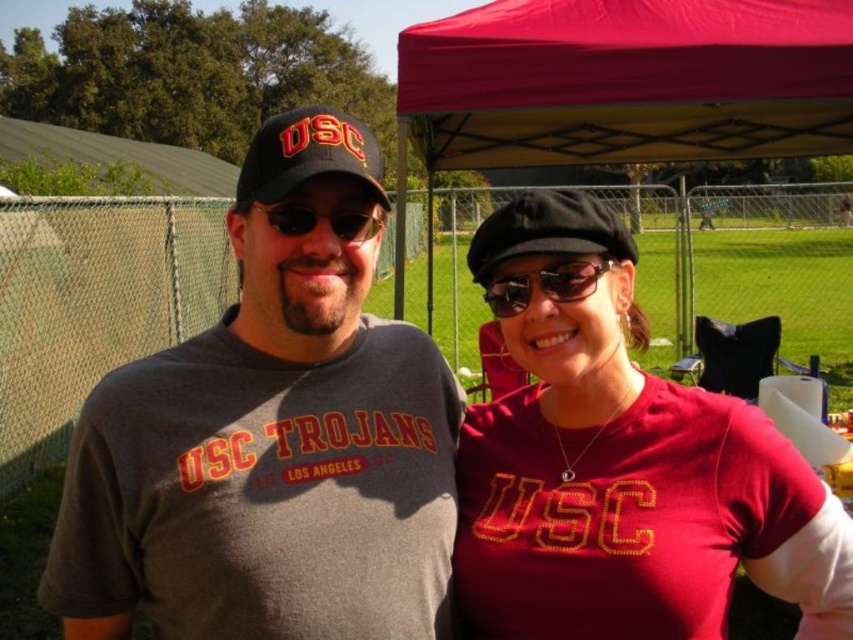
Question: Does gray matte t-shirt at center have a lesser width compared to black matte baseball cap at upper left?

Choices:
 (A) yes
 (B) no

Answer: (A)

Question: Can you confirm if black matte baseball cap at upper left is thinner than sunglasses at center?

Choices:
 (A) no
 (B) yes

Answer: (A)

Question: Is matte red canopy at upper center thinner than black fabric baseball cap at center?

Choices:
 (A) no
 (B) yes

Answer: (A)

Question: Which point is farther to the camera?

Choices:
 (A) matte red canopy at upper center
 (B) sunglasses at center
 (C) gray matte t-shirt at center

Answer: (A)

Question: Which point is farther from the camera taking this photo?

Choices:
 (A) (567, 275)
 (B) (556, 116)

Answer: (B)

Question: Which of these objects is positioned closest to the matte red t-shirt at center?

Choices:
 (A) red fabric canopy at upper center
 (B) black fabric baseball cap at center
 (C) black matte baseball cap at upper left
 (D) gray matte t-shirt at center

Answer: (B)